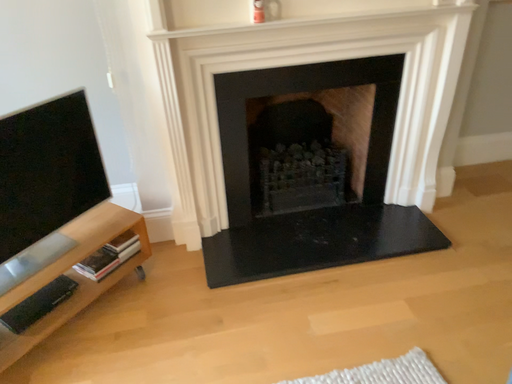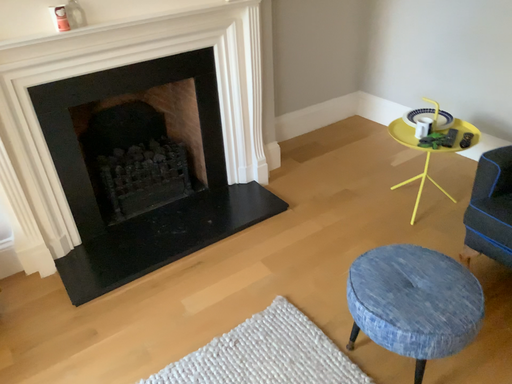
Question: How did the camera likely rotate when shooting the video?

Choices:
 (A) rotated left
 (B) rotated right

Answer: (B)